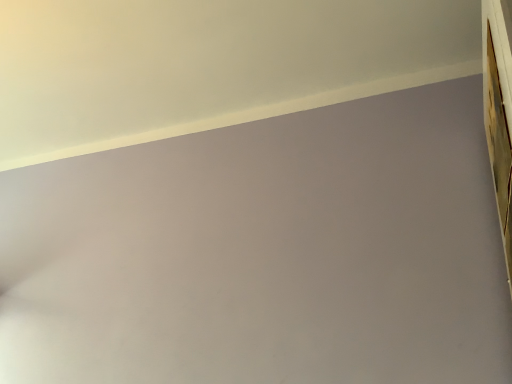
Question: Is wooden frame at upper right to the left or to the right of white smooth wall at upper left in the image?

Choices:
 (A) left
 (B) right

Answer: (B)

Question: Is wooden frame at upper right in front of or behind white smooth wall at upper left in the image?

Choices:
 (A) front
 (B) behind

Answer: (B)

Question: Choose the correct answer: Is wooden frame at upper right inside white smooth wall at upper left or outside it?

Choices:
 (A) outside
 (B) inside

Answer: (A)

Question: Based on their sizes in the image, would you say white smooth wall at upper left is bigger or smaller than wooden frame at upper right?

Choices:
 (A) small
 (B) big

Answer: (B)

Question: From the image's perspective, is white smooth wall at upper left located above or below wooden frame at upper right?

Choices:
 (A) above
 (B) below

Answer: (A)

Question: Considering their positions, is white smooth wall at upper left located in front of or behind wooden frame at upper right?

Choices:
 (A) front
 (B) behind

Answer: (A)

Question: Do you think white smooth wall at upper left is within wooden frame at upper right, or outside of it?

Choices:
 (A) inside
 (B) outside

Answer: (B)